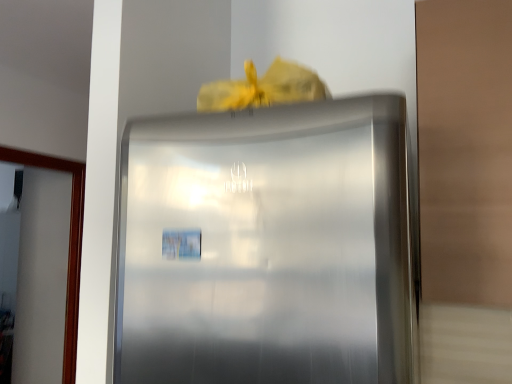
Find the location of a particular element. The height and width of the screenshot is (384, 512). transparent glass door at left is located at coordinates (69, 244).

Image resolution: width=512 pixels, height=384 pixels. What do you see at coordinates (69, 244) in the screenshot? I see `transparent glass door at left` at bounding box center [69, 244].

What do you see at coordinates (266, 246) in the screenshot? I see `satin silver refrigerator at center` at bounding box center [266, 246].

From the picture: What is the approximate height of satin silver refrigerator at center?

The height of satin silver refrigerator at center is 29.84 inches.

I want to click on satin silver refrigerator at center, so click(x=266, y=246).

Identify the location of transparent glass door at left. (69, 244).

From the picture: Which object is positioned more to the left, transparent glass door at left or satin silver refrigerator at center?

transparent glass door at left.

Relative to satin silver refrigerator at center, is transparent glass door at left in front or behind?

transparent glass door at left is positioned farther from the viewer than satin silver refrigerator at center.

Which is behind, point (69, 363) or point (372, 351)?

The point (69, 363) is farther.

From the image's perspective, is transparent glass door at left above satin silver refrigerator at center?

Incorrect, from the image's perspective, transparent glass door at left is lower than satin silver refrigerator at center.

From a real-world perspective, which object rests below the other?

In real-world perspective, transparent glass door at left is lower.

Looking at this image, can you confirm if transparent glass door at left is thinner than satin silver refrigerator at center?

Indeed, transparent glass door at left has a lesser width compared to satin silver refrigerator at center.

Between transparent glass door at left and satin silver refrigerator at center, which one has less height?

Standing shorter between the two is satin silver refrigerator at center.

Does transparent glass door at left have a smaller size compared to satin silver refrigerator at center?

Yes.

Is transparent glass door at left not inside satin silver refrigerator at center?

Yes.

Are transparent glass door at left and satin silver refrigerator at center located far from each other?

Absolutely, transparent glass door at left is distant from satin silver refrigerator at center.

Is transparent glass door at left turned away from satin silver refrigerator at center?

No, transparent glass door at left's orientation is not away from satin silver refrigerator at center.

What's the angular difference between transparent glass door at left and satin silver refrigerator at center's facing directions?

89.8 degrees.

The height and width of the screenshot is (384, 512). Find the location of `refrigerator on the right of the transparent glass door at left`. refrigerator on the right of the transparent glass door at left is located at coordinates (266, 246).

Would you say satin silver refrigerator at center is to the left or to the right of transparent glass door at left in the picture?

satin silver refrigerator at center is positioned on transparent glass door at left's right side.

Is satin silver refrigerator at center positioned before transparent glass door at left?

Yes.

Which is in front, point (131, 168) or point (44, 155)?

Point (131, 168)

From the image's perspective, which one is positioned lower, satin silver refrigerator at center or transparent glass door at left?

transparent glass door at left appears lower in the image.

From a real-world perspective, between satin silver refrigerator at center and transparent glass door at left, who is vertically higher?

From a 3D spatial view, satin silver refrigerator at center is above.

In terms of width, does satin silver refrigerator at center look wider or thinner when compared to transparent glass door at left?

satin silver refrigerator at center is wider than transparent glass door at left.

Who is taller, satin silver refrigerator at center or transparent glass door at left?

Standing taller between the two is transparent glass door at left.

Considering the relative sizes of satin silver refrigerator at center and transparent glass door at left in the image provided, is satin silver refrigerator at center smaller than transparent glass door at left?

No.

Is satin silver refrigerator at center not within transparent glass door at left?

Absolutely, satin silver refrigerator at center is external to transparent glass door at left.

Is satin silver refrigerator at center placed right next to transparent glass door at left?

satin silver refrigerator at center and transparent glass door at left are clearly separated.

Is satin silver refrigerator at center facing towards transparent glass door at left?

No, satin silver refrigerator at center is not facing towards transparent glass door at left.

Can you tell me how much satin silver refrigerator at center and transparent glass door at left differ in facing direction?

The facing directions of satin silver refrigerator at center and transparent glass door at left are 89.8 degrees apart.

I want to click on refrigerator in front of the transparent glass door at left, so (266, 246).

Locate an element on the screen. The image size is (512, 384). refrigerator above the transparent glass door at left (from the image's perspective) is located at coordinates (266, 246).

Where is `refrigerator lying on the right of transparent glass door at left`? The height and width of the screenshot is (384, 512). refrigerator lying on the right of transparent glass door at left is located at coordinates (266, 246).